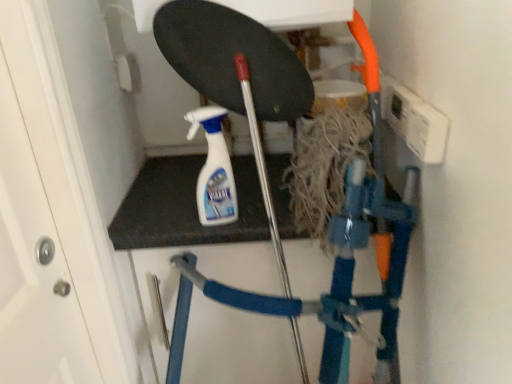
The width and height of the screenshot is (512, 384). Identify the location of blue plastic ladder at center. (332, 280).

In order to face blue plastic ladder at center, should I rotate leftwards or rightwards?

A 1.177 degree turn to the right will do.

Measure the distance between blue plastic ladder at center and camera.

blue plastic ladder at center is 29.57 inches away from camera.

What do you see at coordinates (332, 280) in the screenshot?
I see `blue plastic ladder at center` at bounding box center [332, 280].

Identify the location of white plastic spray bottle at center. (214, 169).

This screenshot has width=512, height=384. What do you see at coordinates (214, 169) in the screenshot? I see `white plastic spray bottle at center` at bounding box center [214, 169].

In order to click on blue plastic ladder at center in this screenshot , I will do `click(332, 280)`.

Can you confirm if blue plastic ladder at center is positioned to the left of white plastic spray bottle at center?

In fact, blue plastic ladder at center is to the right of white plastic spray bottle at center.

Considering the positions of objects blue plastic ladder at center and white plastic spray bottle at center in the image provided, who is in front, blue plastic ladder at center or white plastic spray bottle at center?

white plastic spray bottle at center is in front.

Between point (325, 349) and point (205, 116), which one is positioned in front?

Point (325, 349)

From the image's perspective, relative to white plastic spray bottle at center, is blue plastic ladder at center above or below?

blue plastic ladder at center is situated lower than white plastic spray bottle at center in the image.

From a real-world perspective, between blue plastic ladder at center and white plastic spray bottle at center, who is vertically lower?

In real-world perspective, blue plastic ladder at center is lower.

Can you confirm if blue plastic ladder at center is wider than white plastic spray bottle at center?

Correct, the width of blue plastic ladder at center exceeds that of white plastic spray bottle at center.

Is blue plastic ladder at center taller or shorter than white plastic spray bottle at center?

blue plastic ladder at center is taller than white plastic spray bottle at center.

Who is bigger, blue plastic ladder at center or white plastic spray bottle at center?

With larger size is blue plastic ladder at center.

Can white plastic spray bottle at center be found inside blue plastic ladder at center?

No.

Is blue plastic ladder at center in contact with white plastic spray bottle at center?

blue plastic ladder at center and white plastic spray bottle at center are not in contact.

Does blue plastic ladder at center turn towards white plastic spray bottle at center?

No, blue plastic ladder at center does not turn towards white plastic spray bottle at center.

What's the angular difference between blue plastic ladder at center and white plastic spray bottle at center's facing directions?

The angular difference between blue plastic ladder at center and white plastic spray bottle at center is 13.9 degrees.

How far apart are blue plastic ladder at center and white plastic spray bottle at center?

28.72 centimeters.

You are a GUI agent. You are given a task and a screenshot of the screen. Output one action in this format:
    pyautogui.click(x=<x>, y=<y>)
    Task: Click on the cleaning product that is on the left side of blue plastic ladder at center
    The width and height of the screenshot is (512, 384).
    Given the screenshot: What is the action you would take?
    pyautogui.click(x=214, y=169)

Considering the relative positions of white plastic spray bottle at center and blue plastic ladder at center in the image provided, is white plastic spray bottle at center to the left of blue plastic ladder at center from the viewer's perspective?

Yes.

Considering the positions of objects white plastic spray bottle at center and blue plastic ladder at center in the image provided, who is behind, white plastic spray bottle at center or blue plastic ladder at center?

blue plastic ladder at center is behind.

Considering the points (213, 177) and (333, 279), which point is behind, point (213, 177) or point (333, 279)?

Point (213, 177)

From the image's perspective, is white plastic spray bottle at center positioned above or below blue plastic ladder at center?

From the image's perspective, white plastic spray bottle at center appears above blue plastic ladder at center.

Consider the image. From a real-world perspective, does white plastic spray bottle at center sit lower than blue plastic ladder at center?

No, from a real-world perspective, white plastic spray bottle at center is not beneath blue plastic ladder at center.

Which object is wider, white plastic spray bottle at center or blue plastic ladder at center?

blue plastic ladder at center is wider.

Considering the relative sizes of white plastic spray bottle at center and blue plastic ladder at center in the image provided, is white plastic spray bottle at center shorter than blue plastic ladder at center?

Indeed, white plastic spray bottle at center has a lesser height compared to blue plastic ladder at center.

Based on the photo, considering the relative sizes of white plastic spray bottle at center and blue plastic ladder at center in the image provided, is white plastic spray bottle at center bigger than blue plastic ladder at center?

No.

Based on the photo, would you say white plastic spray bottle at center contains blue plastic ladder at center?

That's incorrect, blue plastic ladder at center is not inside white plastic spray bottle at center.

Are white plastic spray bottle at center and blue plastic ladder at center beside each other?

white plastic spray bottle at center is not next to blue plastic ladder at center, and they're not touching.

Does white plastic spray bottle at center turn towards blue plastic ladder at center?

No, white plastic spray bottle at center is not turned towards blue plastic ladder at center.

How many degrees apart are the facing directions of white plastic spray bottle at center and blue plastic ladder at center?

13.9 degrees.

In the image, there is a white plastic spray bottle at center. Where is `ladder below it (from a real-world perspective)`? This screenshot has height=384, width=512. ladder below it (from a real-world perspective) is located at coordinates (332, 280).

At what (x,y) coordinates should I click in order to perform the action: click on cleaning product above the blue plastic ladder at center (from a real-world perspective). Please return your answer as a coordinate pair (x, y). Image resolution: width=512 pixels, height=384 pixels. Looking at the image, I should click on (214, 169).

The height and width of the screenshot is (384, 512). Identify the location of cleaning product in front of the blue plastic ladder at center. (214, 169).